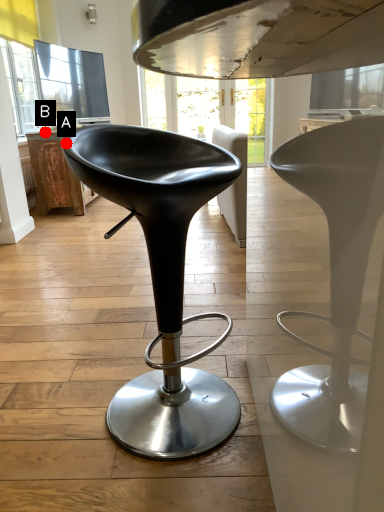
Question: Two points are circled on the image, labeled by A and B beside each circle. Which point is closer to the camera?

Choices:
 (A) A is closer
 (B) B is closer

Answer: (A)